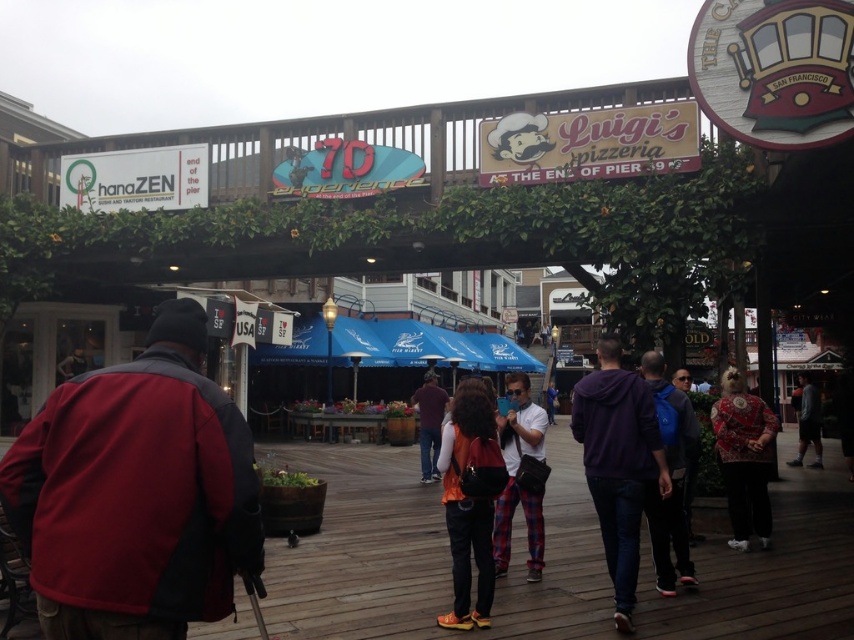
You are standing at the center of the walkway and want to find the dark gray hoodie at lower right. Based on the coordinates provided, in which direction should you look to locate it?

The dark gray hoodie at lower right is located at coordinates point [808,422], so you should look to the lower right direction to find it.

You are a photographer trying to capture a shot of the dark gray hoodie at lower right and the blue jeans at center. If you want to ensure both subjects are fully visible in the frame, which subject should you position closer to the camera?

The dark gray hoodie at lower right might be wider than blue jeans at center, so to ensure both are fully visible, position the dark gray hoodie at lower right closer to the camera.

You are standing at the point marked as point (x=137, y=493) in the image. Looking around, you see a red fleece jacket at left and other people dressed in purple, blue, and orange. Which direction should you walk to reach the nearest exit located at the end of the wooden walkway?

The point (x=137, y=493) is on the red fleece jacket at left. To reach the nearest exit at the end of the wooden walkway, you should walk away from the red fleece jacket at left towards the direction opposite of where it is located.